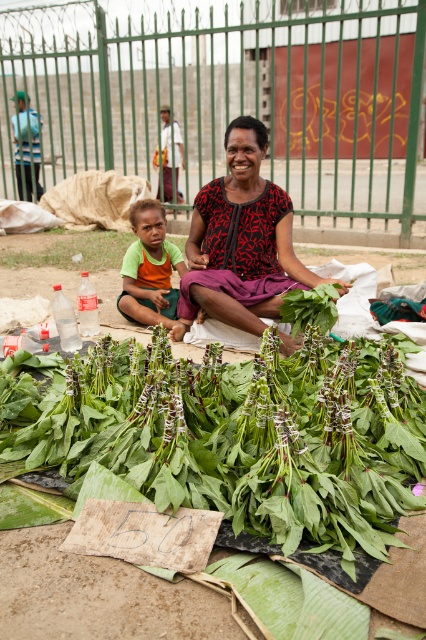
Question: Does green leafy vegetables at center appear over printed fabric blouse at center?

Choices:
 (A) no
 (B) yes

Answer: (A)

Question: Is printed fabric blouse at center positioned at the back of green fabric shirt at center?

Choices:
 (A) yes
 (B) no

Answer: (B)

Question: Which object is the closest to the green fabric shirt at center?

Choices:
 (A) printed fabric blouse at center
 (B) green leafy vegetables at center

Answer: (A)

Question: Where is printed fabric blouse at center located in relation to green fabric shirt at center in the image?

Choices:
 (A) left
 (B) right

Answer: (B)

Question: Which of the following is the farthest from the observer?

Choices:
 (A) (141, 241)
 (B) (261, 182)

Answer: (A)

Question: Which of the following is the closest to the observer?

Choices:
 (A) printed fabric blouse at center
 (B) green fabric shirt at center
 (C) green leafy vegetables at center

Answer: (C)